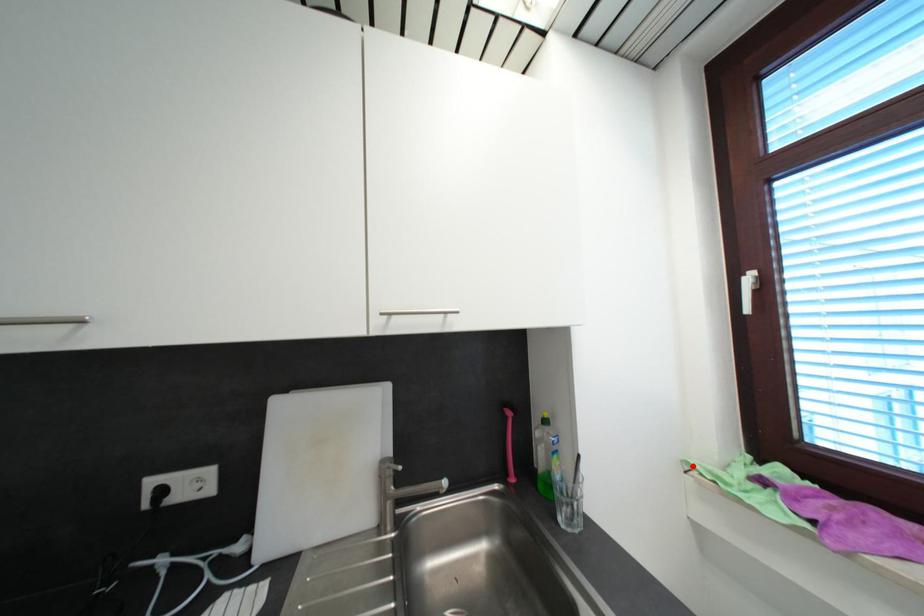
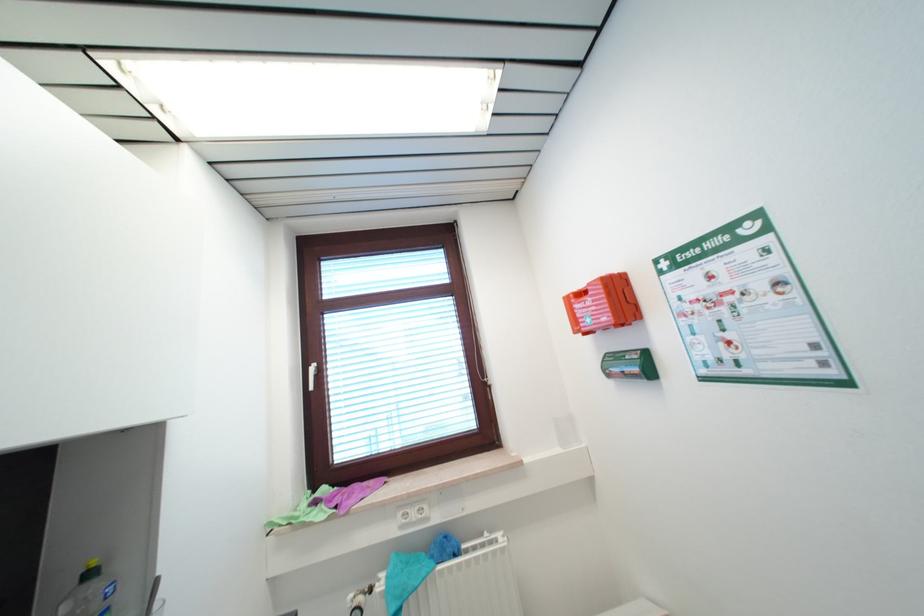
Where in the second image is the point corresponding to the highlighted location from the first image?

(274, 525)